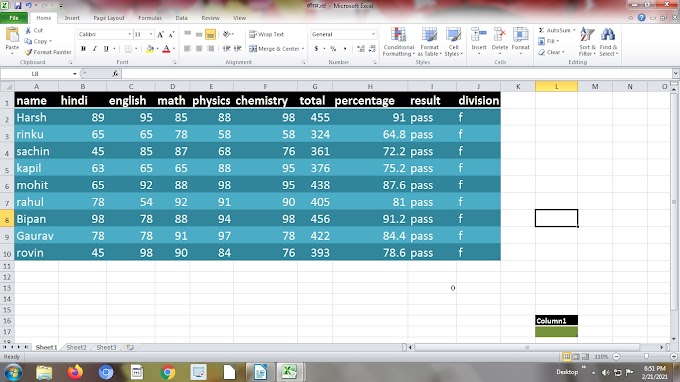
Find the location of a particular element. column headers on the table is located at coordinates (28, 102), (80, 99), (129, 102), (177, 103), (200, 102), (260, 101), (309, 100), (358, 95), (428, 94), (476, 97).